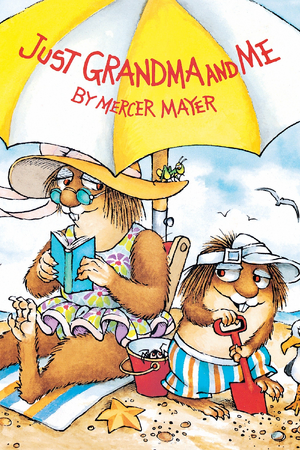
Image resolution: width=300 pixels, height=450 pixels. Identify the location of red bucket. (150, 377).